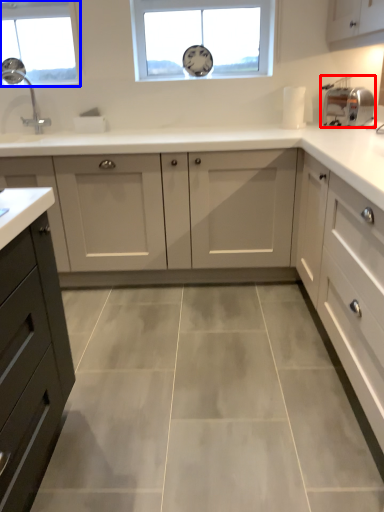
Question: Which object appears closest to the camera in this image, appliance (highlighted by a red box) or window (highlighted by a blue box)?

Choices:
 (A) appliance
 (B) window

Answer: (A)